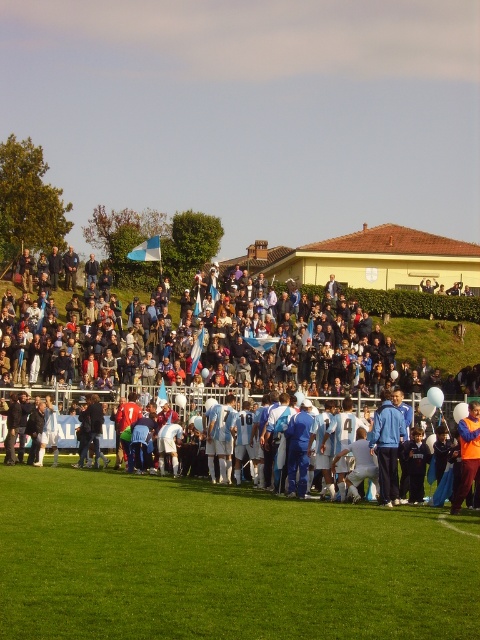
Question: From the image, what is the correct spatial relationship of white matte soccer team at upper center in relation to white matte soccer players at center?

Choices:
 (A) above
 (B) below

Answer: (A)

Question: Which of these objects is positioned closest to the white matte soccer team at upper center?

Choices:
 (A) white matte soccer players at center
 (B) green grass field at lower center

Answer: (A)

Question: Is green grass field at lower center positioned in front of white matte soccer team at upper center?

Choices:
 (A) yes
 (B) no

Answer: (A)

Question: Among these objects, which one is farthest from the camera?

Choices:
 (A) white matte soccer team at upper center
 (B) white matte soccer players at center

Answer: (A)

Question: Which of the following is the closest to the observer?

Choices:
 (A) white matte soccer players at center
 (B) white matte soccer team at upper center
 (C) green grass field at lower center

Answer: (C)

Question: Is green grass field at lower center smaller than white matte soccer players at center?

Choices:
 (A) yes
 (B) no

Answer: (A)